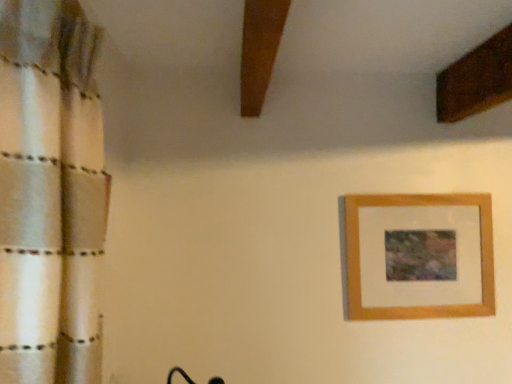
This screenshot has height=384, width=512. What do you see at coordinates (419, 256) in the screenshot?
I see `wooden picture frame at upper right` at bounding box center [419, 256].

What is the approximate height of wooden picture frame at upper right?

wooden picture frame at upper right is 19.83 inches tall.

You are a GUI agent. You are given a task and a screenshot of the screen. Output one action in this format:
    pyautogui.click(x=<x>, y=<y>)
    Task: Click on the wooden picture frame at upper right
    The image size is (512, 384).
    Given the screenshot: What is the action you would take?
    pyautogui.click(x=419, y=256)

Where is `wooden picture frame at upper right`? Image resolution: width=512 pixels, height=384 pixels. wooden picture frame at upper right is located at coordinates (419, 256).